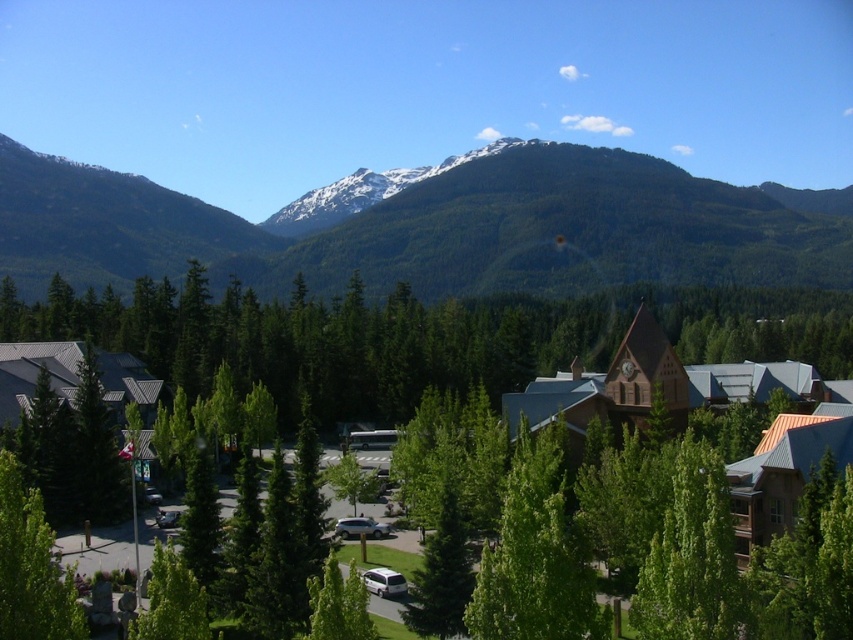
Does green forested mountain range at upper center appear on the left side of green matte tree at lower left?

In fact, green forested mountain range at upper center is to the right of green matte tree at lower left.

Who is taller, green forested mountain range at upper center or green matte tree at lower left?

Standing taller between the two is green forested mountain range at upper center.

Does point (477, 225) lie behind point (22, 518)?

Yes.

This screenshot has width=853, height=640. I want to click on green forested mountain range at upper center, so click(x=428, y=228).

Is green forested mountain range at upper center thinner than green leafy tree at lower left?

No.

Can you confirm if green forested mountain range at upper center is positioned below green leafy tree at lower left?

Actually, green forested mountain range at upper center is above green leafy tree at lower left.

What do you see at coordinates (428, 228) in the screenshot? The image size is (853, 640). I see `green forested mountain range at upper center` at bounding box center [428, 228].

You are a GUI agent. You are given a task and a screenshot of the screen. Output one action in this format:
    pyautogui.click(x=<x>, y=<y>)
    Task: Click on the green forested mountain range at upper center
    Image resolution: width=853 pixels, height=640 pixels.
    Given the screenshot: What is the action you would take?
    pyautogui.click(x=428, y=228)

Which of these two, green matte tree at center or green matte tree at lower left, stands shorter?

green matte tree at lower left is shorter.

Does green matte tree at center have a lesser width compared to green matte tree at lower left?

Incorrect, green matte tree at center's width is not less than green matte tree at lower left's.

Is point (590, 314) less distant than point (10, 548)?

No.

The height and width of the screenshot is (640, 853). I want to click on green matte tree at center, so pos(416,337).